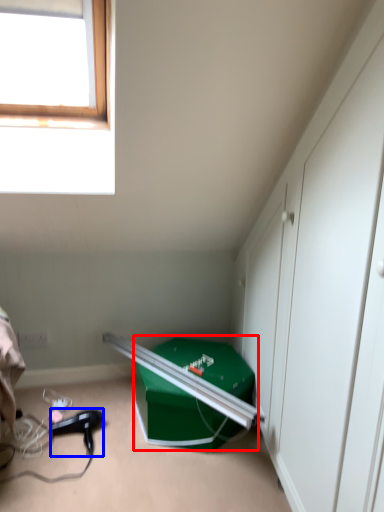
Question: Which point is closer to the camera, box (highlighted by a red box) or hair drier (highlighted by a blue box)?

Choices:
 (A) box
 (B) hair drier

Answer: (A)